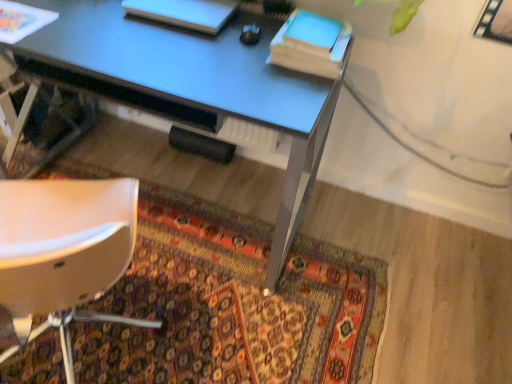
Question: In the image, is white matte book at upper center, the first book in the left-to-right sequence, on the left side or the right side of metallic blue desk at center?

Choices:
 (A) left
 (B) right

Answer: (B)

Question: Is white matte book at upper center, the first book in the left-to-right sequence, spatially inside metallic blue desk at center, or outside of it?

Choices:
 (A) outside
 (B) inside

Answer: (B)

Question: Based on their relative distances, which object is farther from the metallic blue desk at center?

Choices:
 (A) matte blue book at upper right, positioned as the second book in left-to-right order
 (B) white matte book at upper center, the first book in the left-to-right sequence
 (C) white plastic chair at lower left
 (D) carpeted rug at lower center
 (E) blue matte notepad at upper right

Answer: (D)

Question: Which object is the closest to the white matte book at upper center, the first book in the left-to-right sequence?

Choices:
 (A) matte blue book at upper right, which ranks as the 1th book in right-to-left order
 (B) white plastic chair at lower left
 (C) metallic blue desk at center
 (D) carpeted rug at lower center
 (E) blue matte notepad at upper right

Answer: (C)